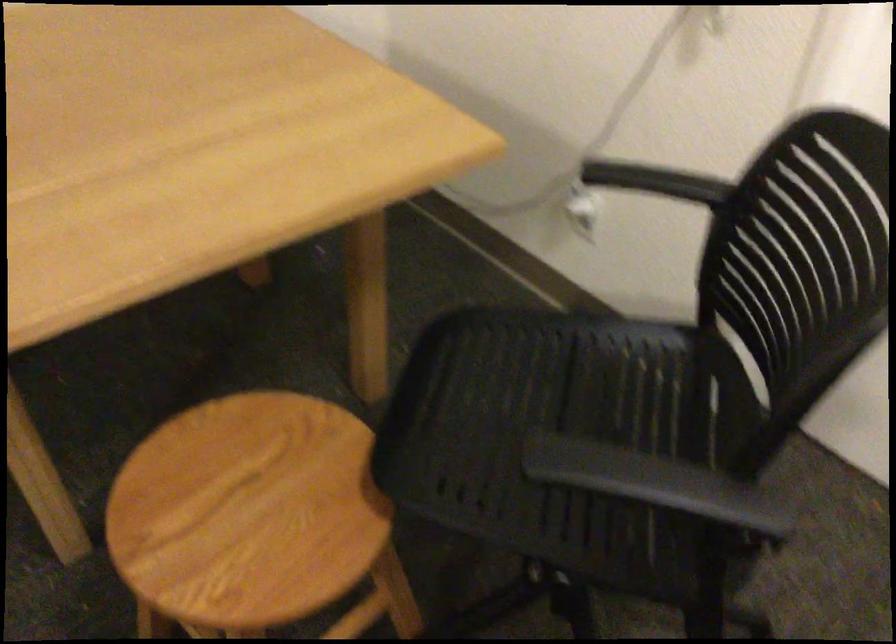
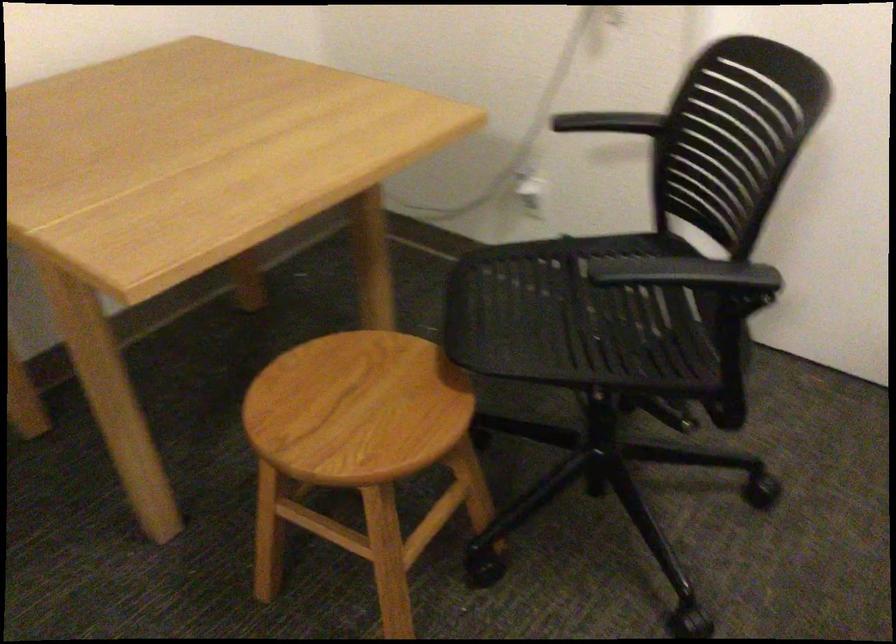
Locate, in the second image, the point that corresponds to [260,500] in the first image.

(356, 408)